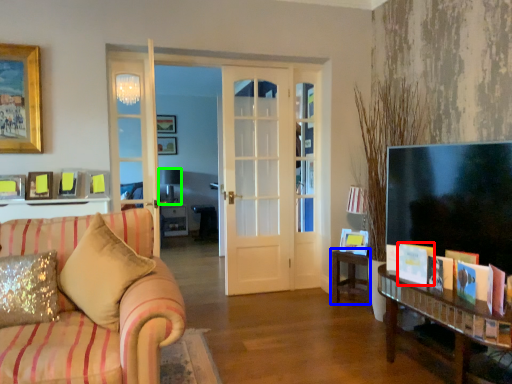
Question: Which is farther away from book (highlighted by a red box)? table (highlighted by a blue box) or lamp (highlighted by a green box)?

Choices:
 (A) table
 (B) lamp

Answer: (B)